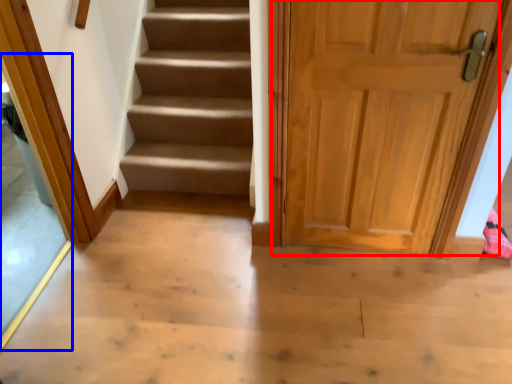
Question: Which point is further to the camera, door (highlighted by a red box) or glass door (highlighted by a blue box)?

Choices:
 (A) door
 (B) glass door

Answer: (A)